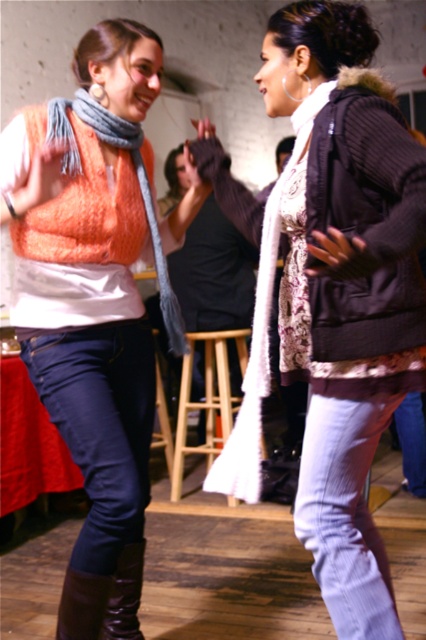
Question: Which of the following is the closest to the observer?

Choices:
 (A) (111, 435)
 (B) (135, 625)
 (C) (294, 92)

Answer: (C)

Question: Is wooden stool at center below leather boot at lower left?

Choices:
 (A) yes
 (B) no

Answer: (B)

Question: Among these points, which one is nearest to the camera?

Choices:
 (A) (224, 330)
 (B) (77, 636)
 (C) (146, 481)

Answer: (B)

Question: Which object appears farthest from the camera in this image?

Choices:
 (A) wooden stool at center
 (B) matte orange vest at center

Answer: (A)

Question: Does matte orange vest at center have a smaller size compared to silver metallic earring at upper left?

Choices:
 (A) no
 (B) yes

Answer: (A)

Question: Where is matte orange vest at center located in relation to wooden stool at center in the image?

Choices:
 (A) left
 (B) right

Answer: (A)